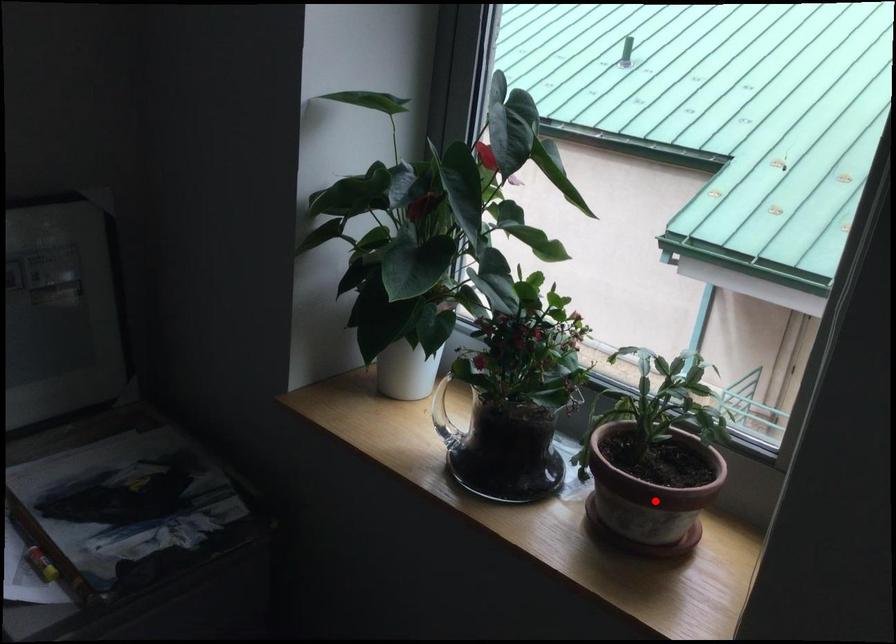
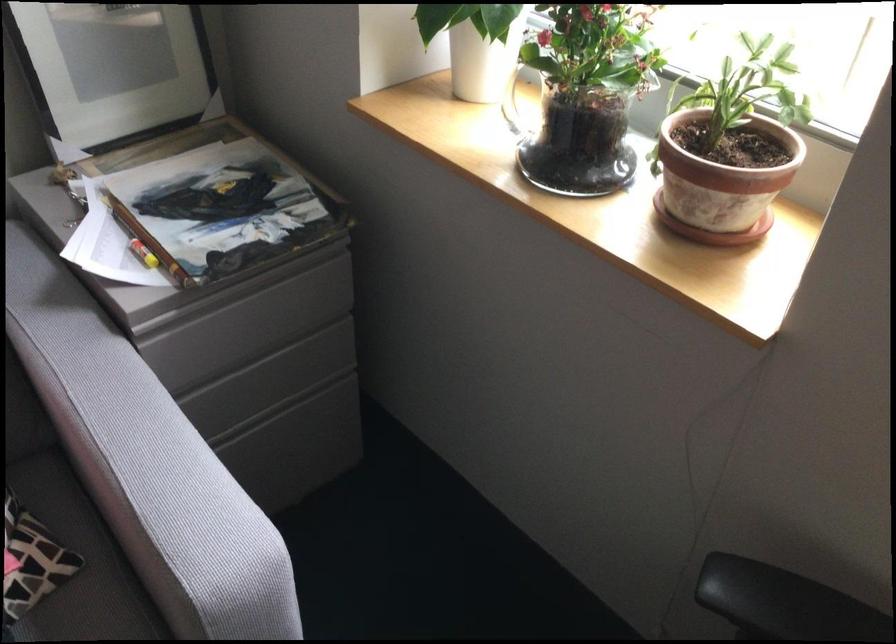
The point at the highlighted location is marked in the first image. Where is the corresponding point in the second image?

(721, 184)